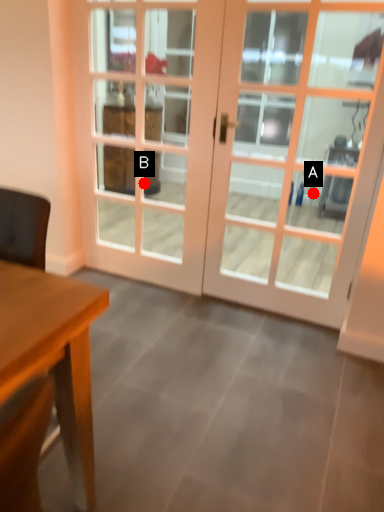
Question: Two points are circled on the image, labeled by A and B beside each circle. Which point is closer to the camera?

Choices:
 (A) A is closer
 (B) B is closer

Answer: (A)